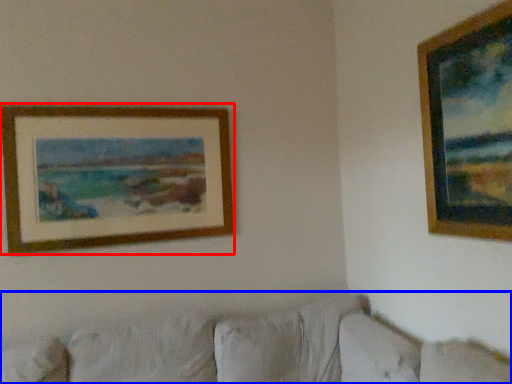
Question: Which of the following is the farthest to the observer, picture frame (highlighted by a red box) or couch (highlighted by a blue box)?

Choices:
 (A) picture frame
 (B) couch

Answer: (A)